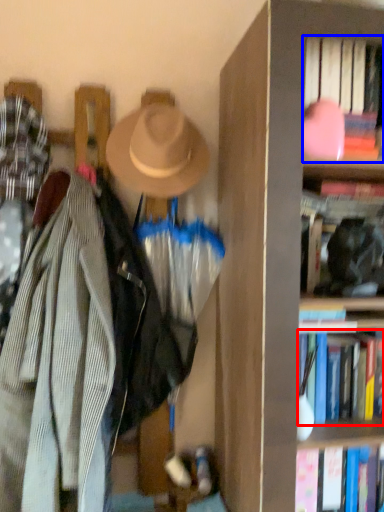
Question: Which object appears farthest to the camera in this image, book (highlighted by a red box) or book (highlighted by a blue box)?

Choices:
 (A) book
 (B) book

Answer: (A)